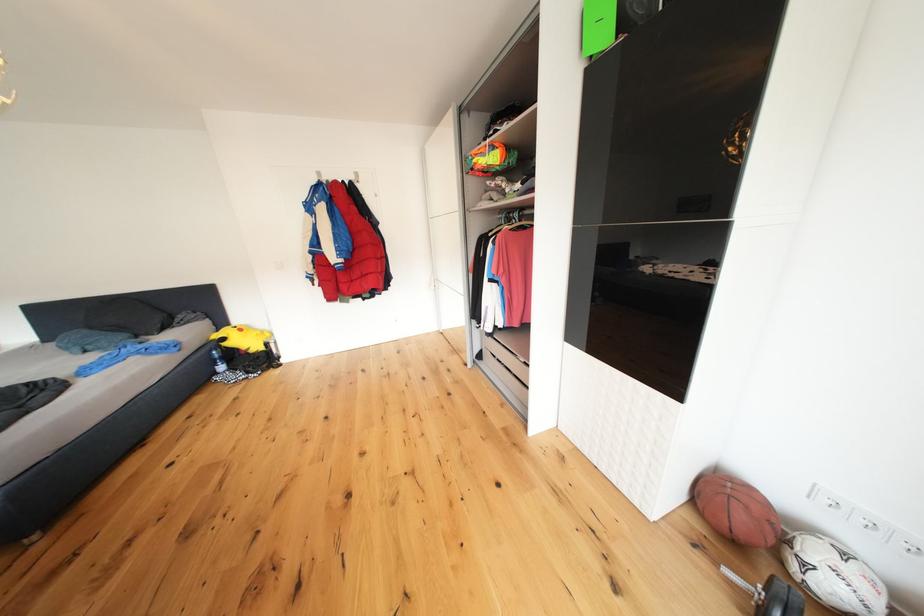
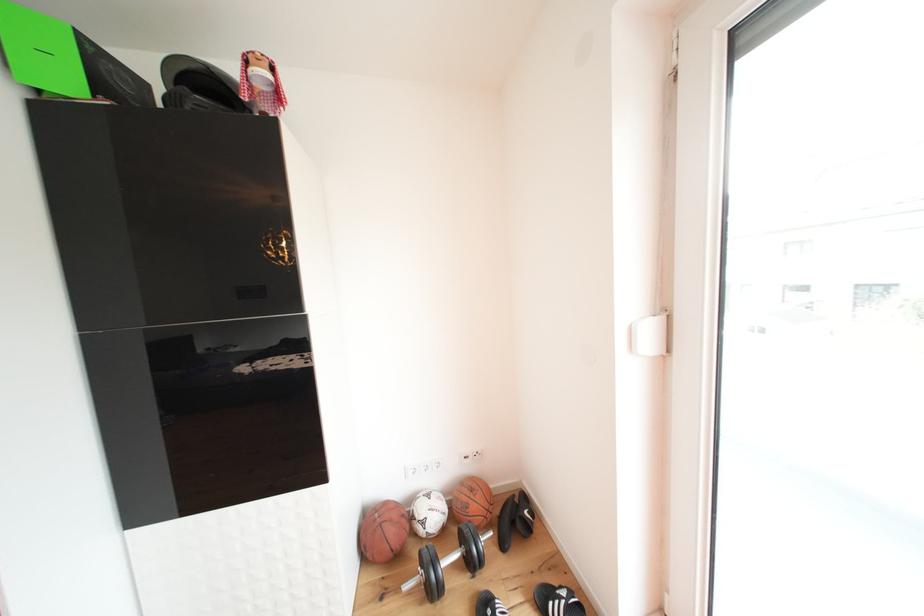
In the second image, find the point that corresponds to point (760, 493) in the first image.

(395, 509)